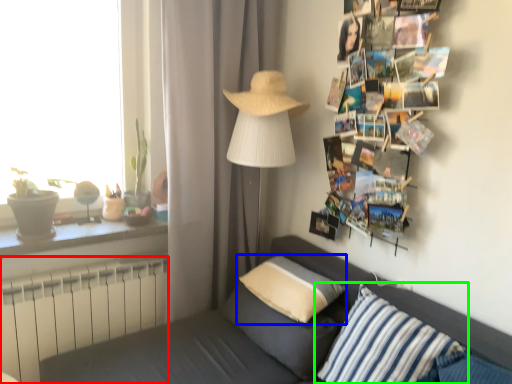
Question: Estimate the real-world distances between objects in this image. Which object is closer to radiator (highlighted by a red box), pillow (highlighted by a blue box) or pillow (highlighted by a green box)?

Choices:
 (A) pillow
 (B) pillow

Answer: (A)